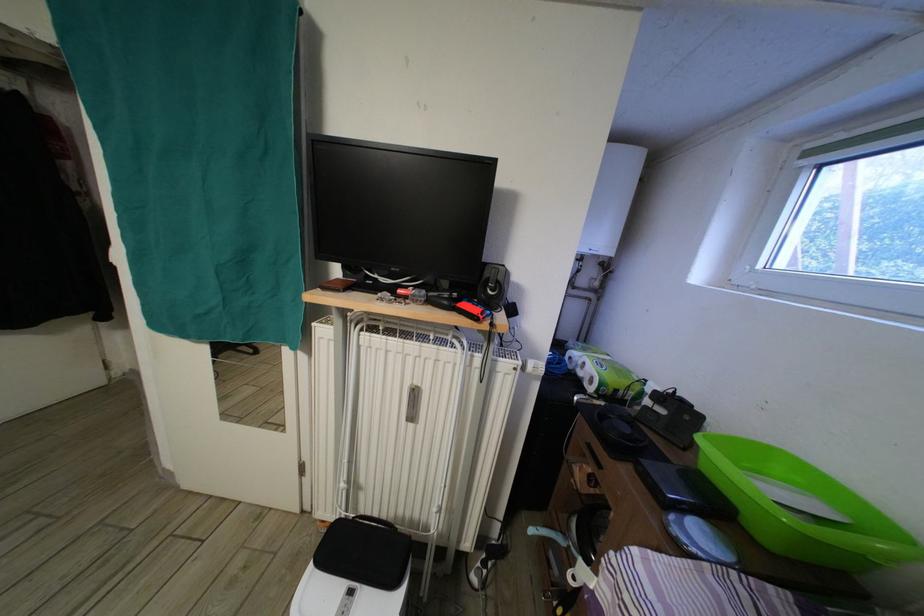
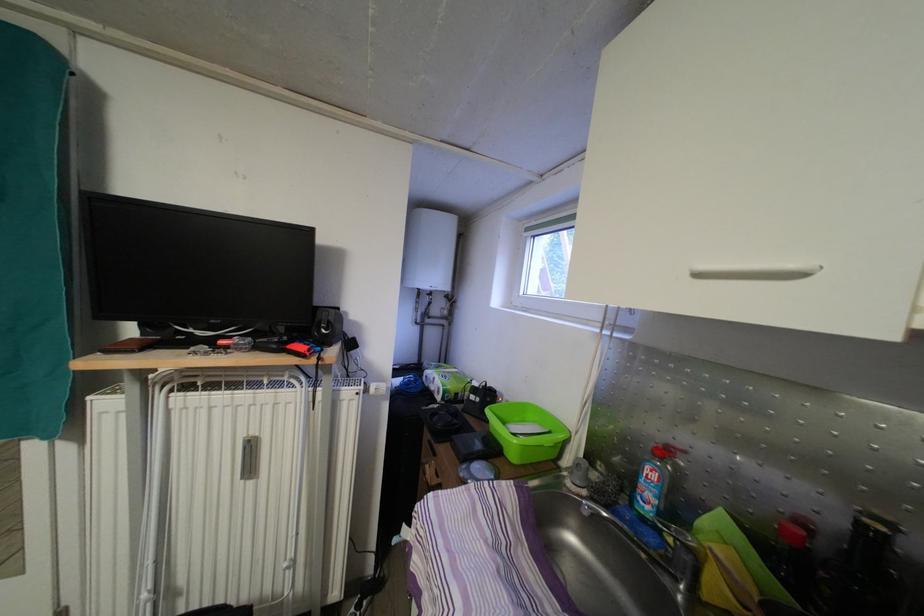
The point at (494, 286) is marked in the first image. Where is the corresponding point in the second image?

(326, 329)